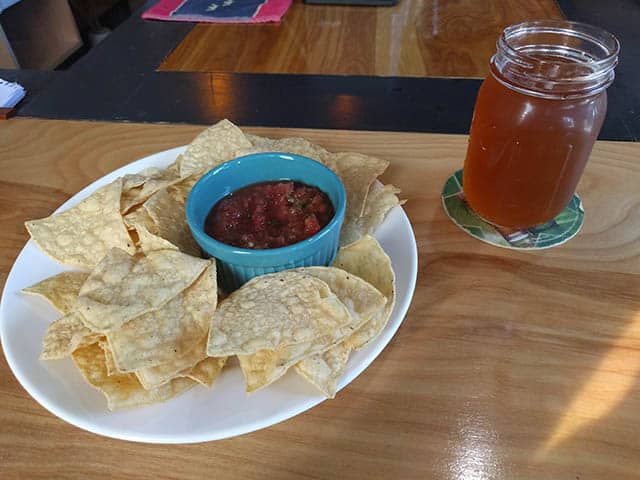
The image size is (640, 480). What are the coordinates of `plate` in the screenshot? It's located at (224, 405).